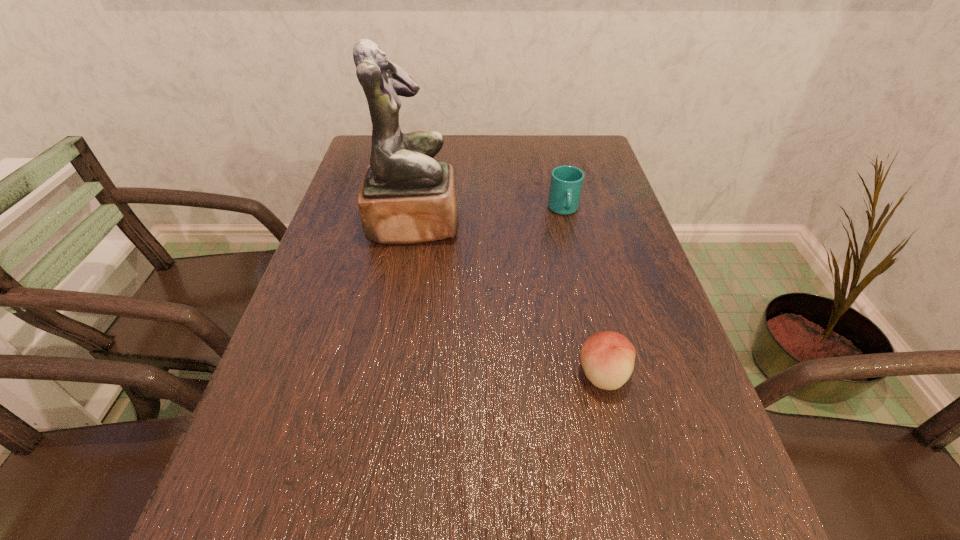
Locate an element on the screen. The height and width of the screenshot is (540, 960). the leftmost object is located at coordinates (407, 197).

Identify the location of the tallest object. (407, 197).

This screenshot has height=540, width=960. I want to click on cup, so click(x=566, y=183).

This screenshot has width=960, height=540. Find the location of `the shortest object`. the shortest object is located at coordinates (607, 357).

The image size is (960, 540). What are the coordinates of `the nearest object` in the screenshot? It's located at (607, 357).

Where is `free space located 0.160m in a relaxed pose on the leftmost object`? free space located 0.160m in a relaxed pose on the leftmost object is located at coordinates (520, 223).

The image size is (960, 540). In order to click on vacant space positioned on the handle side of the cup in this screenshot , I will do `click(576, 264)`.

This screenshot has height=540, width=960. Find the location of `vacant region located on the back of the shortest object`. vacant region located on the back of the shortest object is located at coordinates (579, 269).

Find the location of a particular element. The width and height of the screenshot is (960, 540). object that is at the left edge is located at coordinates (407, 197).

Locate an element on the screen. This screenshot has height=540, width=960. cup present at the right edge is located at coordinates (566, 183).